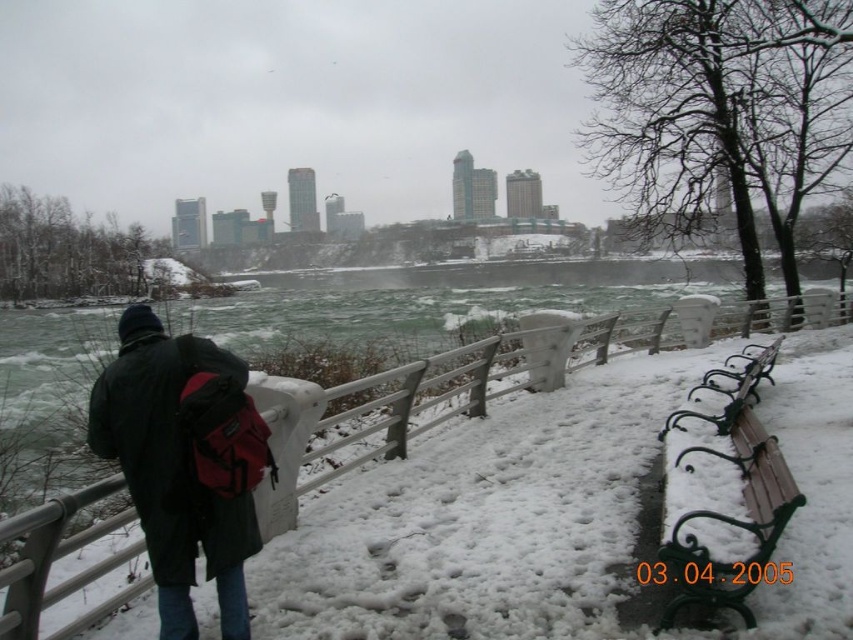
You are a tourist visiting Niagara Falls in winter and want to take a photo of the matte black jacket at left and the wooden bench at right. Which object should you focus on first if you want to capture both in the same frame without moving the camera?

The matte black jacket at left is positioned over the wooden bench at right, so you should focus on the matte black jacket at left first to ensure both are in the frame.

You are standing at the point marked as point (173,467) in the winter scene at Niagara Falls. What object is located at that point?

The point (173,467) is located on the matte black jacket at left.